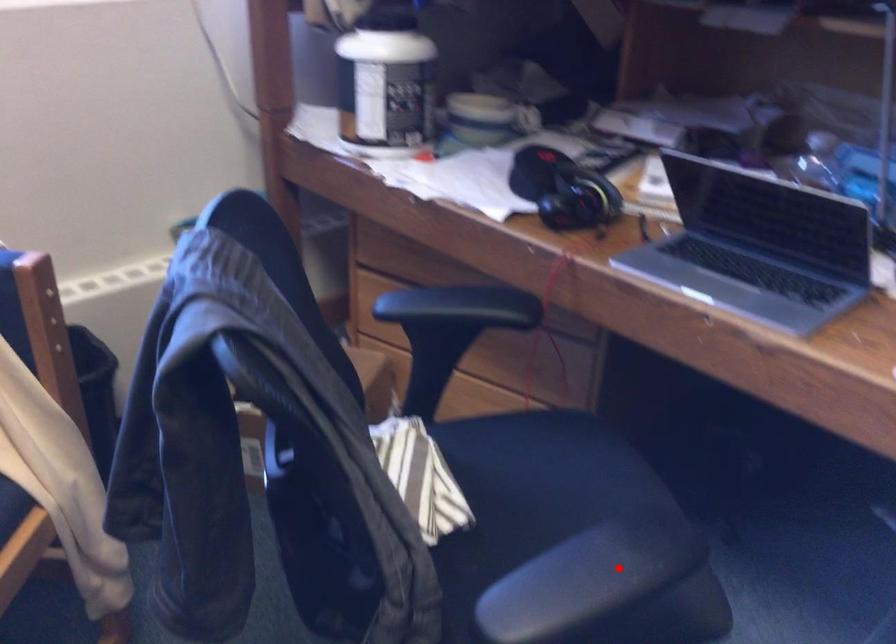
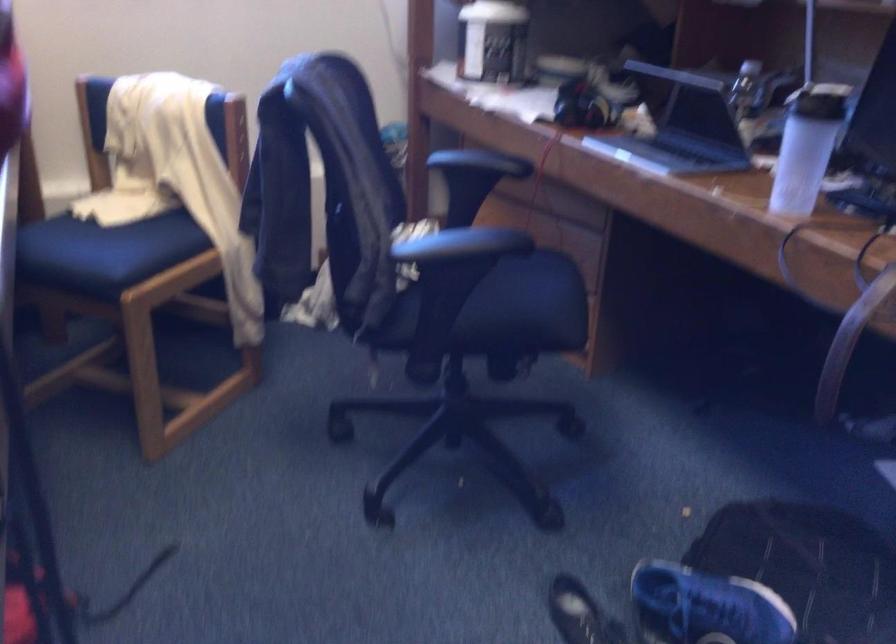
Question: I am providing you with two images of the same scene from different viewpoints. A red point is shown in image1. For the corresponding object point in image2, is it positioned nearer or farther from the camera?

Choices:
 (A) Nearer
 (B) Farther

Answer: (B)